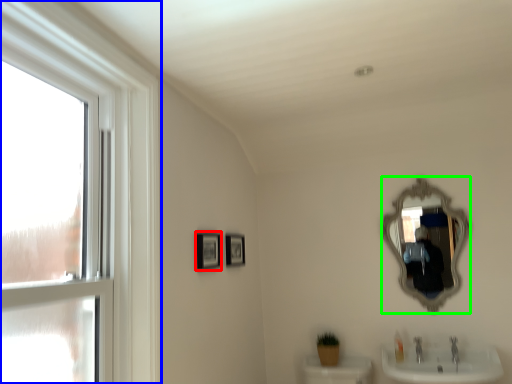
Question: Considering the real-world distances, which object is farthest from picture frame (highlighted by a red box)? window (highlighted by a blue box) or mirror (highlighted by a green box)?

Choices:
 (A) window
 (B) mirror

Answer: (B)